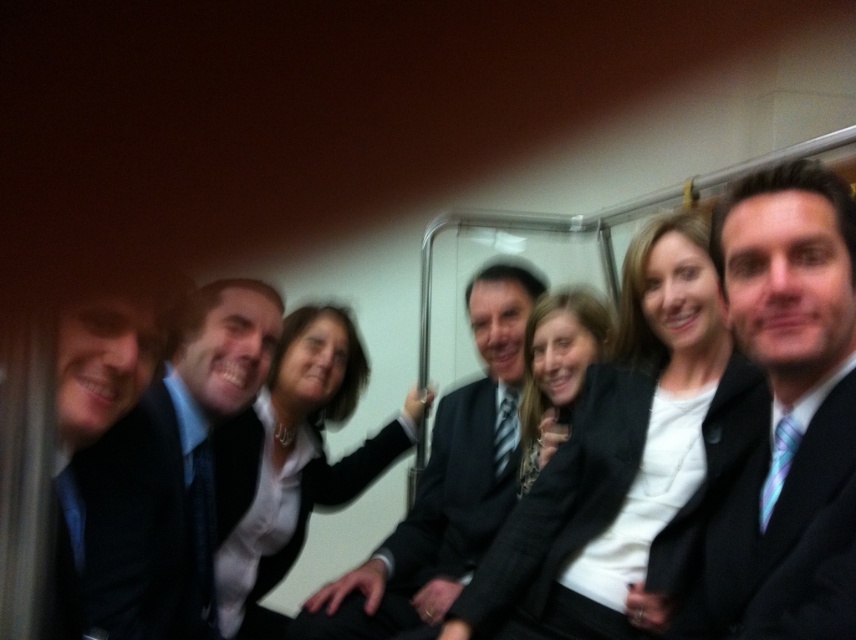
Locate an element on the screen. This screenshot has width=856, height=640. white textured blazer at center is located at coordinates (628, 461).

Can you confirm if white textured blazer at center is positioned above dark gray suit at center?

Yes.

Does point (676, 436) lie behind point (385, 564)?

That is False.

The width and height of the screenshot is (856, 640). I want to click on white textured blazer at center, so click(628, 461).

Does point (223, 337) come in front of point (476, 525)?

Yes, point (223, 337) is in front of point (476, 525).

Locate an element on the screen. matte black suit at left is located at coordinates (171, 470).

Between dark gray suit at center and matte black blazer at center, which one is positioned lower?

dark gray suit at center is lower down.

Consider the image. Can you confirm if dark gray suit at center is bigger than matte black blazer at center?

Indeed, dark gray suit at center has a larger size compared to matte black blazer at center.

The image size is (856, 640). I want to click on dark gray suit at center, so click(x=444, y=484).